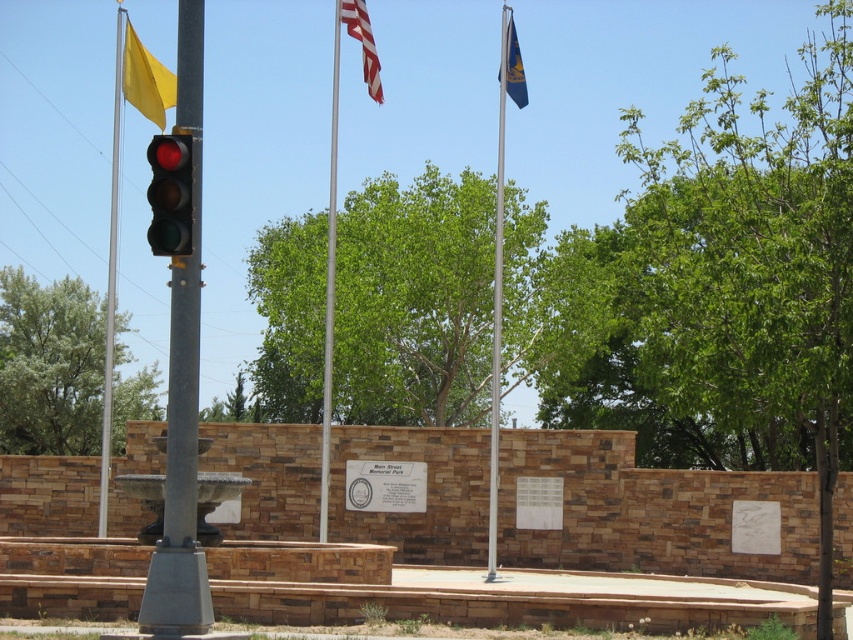
You are standing in front of the stone wall structure with plaques. You notice a yellow fabric flag at upper left. Based on its coordinates, can you determine if it is positioned to the left or right of the traffic light pole?

The yellow fabric flag at upper left is positioned at coordinates point (144,77). Since the traffic light pole is on the left side of the image, the flag is to the left of the traffic light pole.

You are standing in the plaza looking at the stone wall with plaques. There are two points marked on the ground in front of you at coordinates point (132,38) and point (364,56). Which point is closer to you?

Point (132,38) is closer to the viewer than point (364,56).